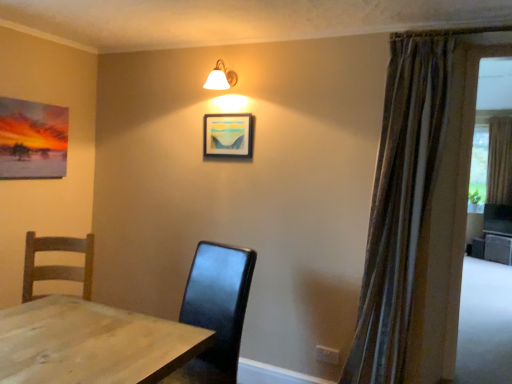
Question: Is matte wooden picture frame at upper center located within striped fabric curtain at right, marked as the first curtain in a left-to-right arrangement?

Choices:
 (A) yes
 (B) no

Answer: (B)

Question: Considering the relative sizes of striped fabric curtain at right, the second curtain from the back, and matte wooden picture frame at upper center in the image provided, is striped fabric curtain at right, the second curtain from the back, shorter than matte wooden picture frame at upper center?

Choices:
 (A) no
 (B) yes

Answer: (A)

Question: Is striped fabric curtain at right, the 1th curtain positioned from the front, to the right of matte wooden picture frame at upper center from the viewer's perspective?

Choices:
 (A) yes
 (B) no

Answer: (A)

Question: Is striped fabric curtain at right, marked as the first curtain in a left-to-right arrangement, bigger than matte wooden picture frame at upper center?

Choices:
 (A) yes
 (B) no

Answer: (A)

Question: Is striped fabric curtain at right, marked as the first curtain in a left-to-right arrangement, wider than matte wooden picture frame at upper center?

Choices:
 (A) no
 (B) yes

Answer: (B)

Question: Is white glass lamp at upper center to the left or to the right of matte wooden picture frame at upper center in the image?

Choices:
 (A) right
 (B) left

Answer: (B)

Question: In terms of size, does white glass lamp at upper center appear bigger or smaller than matte wooden picture frame at upper center?

Choices:
 (A) big
 (B) small

Answer: (A)

Question: Considering the positions of white glass lamp at upper center and matte wooden picture frame at upper center in the image, is white glass lamp at upper center taller or shorter than matte wooden picture frame at upper center?

Choices:
 (A) tall
 (B) short

Answer: (B)

Question: Considering the positions of white glass lamp at upper center and matte wooden picture frame at upper center in the image, is white glass lamp at upper center wider or thinner than matte wooden picture frame at upper center?

Choices:
 (A) thin
 (B) wide

Answer: (B)

Question: Is white glass lamp at upper center inside the boundaries of brown textured curtain at right, acting as the 2th curtain starting from the front, or outside?

Choices:
 (A) inside
 (B) outside

Answer: (B)

Question: Does point (224, 84) appear closer or farther from the camera than point (499, 200)?

Choices:
 (A) farther
 (B) closer

Answer: (B)

Question: Considering the positions of white glass lamp at upper center and brown textured curtain at right, acting as the 2th curtain starting from the front, in the image, is white glass lamp at upper center taller or shorter than brown textured curtain at right, acting as the 2th curtain starting from the front,?

Choices:
 (A) tall
 (B) short

Answer: (B)

Question: Is white glass lamp at upper center in front of or behind brown textured curtain at right, positioned as the first curtain in right-to-left order, in the image?

Choices:
 (A) behind
 (B) front

Answer: (B)

Question: Is striped fabric curtain at right, marked as the first curtain in a left-to-right arrangement, situated inside white glass lamp at upper center or outside?

Choices:
 (A) inside
 (B) outside

Answer: (B)

Question: Considering the positions of striped fabric curtain at right, marked as the first curtain in a left-to-right arrangement, and white glass lamp at upper center in the image, is striped fabric curtain at right, marked as the first curtain in a left-to-right arrangement, bigger or smaller than white glass lamp at upper center?

Choices:
 (A) big
 (B) small

Answer: (A)